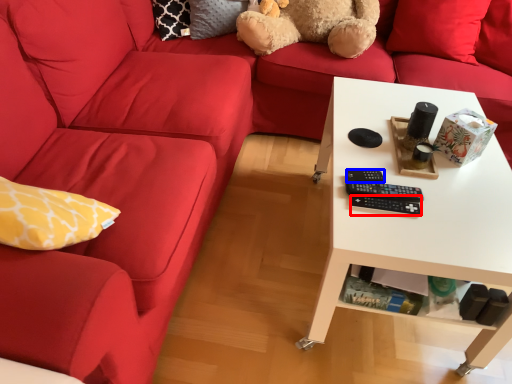
Question: Which point is further to the camera, control (highlighted by a red box) or control (highlighted by a blue box)?

Choices:
 (A) control
 (B) control

Answer: (B)